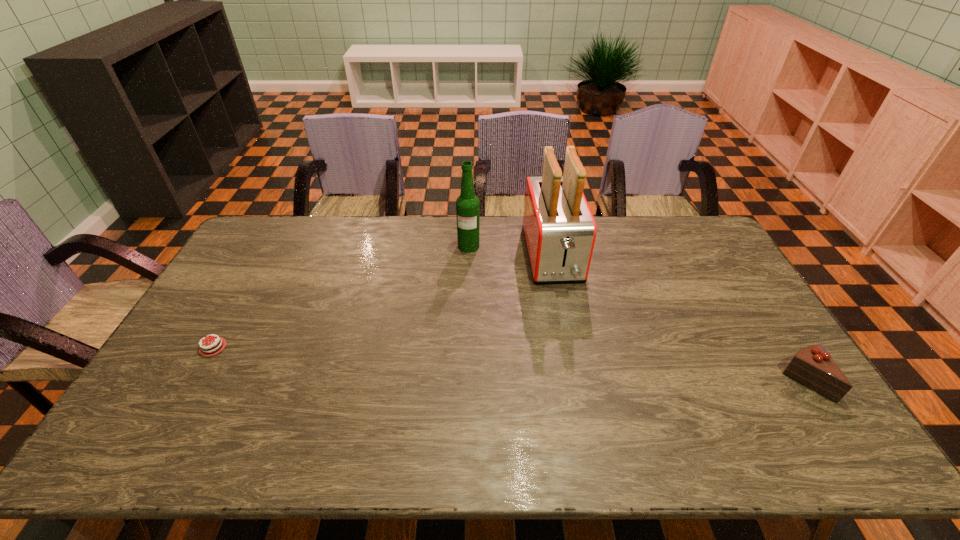
I want to click on free space located 0.180m on the label of the beer bottle, so click(464, 288).

You are a GUI agent. You are given a task and a screenshot of the screen. Output one action in this format:
    pyautogui.click(x=<x>, y=<y>)
    Task: Click on the vacant space located 0.310m on the front-facing side of the third object from left to right
    Image resolution: width=960 pixels, height=540 pixels.
    Given the screenshot: What is the action you would take?
    pyautogui.click(x=582, y=370)

Find the location of `vacant point located 0.160m on the front-facing side of the third object from left to right`. vacant point located 0.160m on the front-facing side of the third object from left to right is located at coordinates (570, 329).

Where is `free location located on the front-facing side of the third object from left to right`? The image size is (960, 540). free location located on the front-facing side of the third object from left to right is located at coordinates (575, 347).

I want to click on beer bottle present at the far edge, so click(x=467, y=204).

Image resolution: width=960 pixels, height=540 pixels. I want to click on toaster positioned at the far edge, so [559, 229].

In order to click on object present at the near edge in this screenshot , I will do `click(812, 366)`.

At what (x,y) coordinates should I click in order to perform the action: click on object positioned at the left edge. Please return your answer as a coordinate pair (x, y). Looking at the image, I should click on (215, 345).

This screenshot has width=960, height=540. Find the location of `object positioned at the right edge`. object positioned at the right edge is located at coordinates (812, 366).

You are a GUI agent. You are given a task and a screenshot of the screen. Output one action in this format:
    pyautogui.click(x=<x>, y=<y>)
    Task: Click on the object positioned at the near right corner
    Image resolution: width=960 pixels, height=540 pixels.
    Given the screenshot: What is the action you would take?
    pyautogui.click(x=812, y=366)